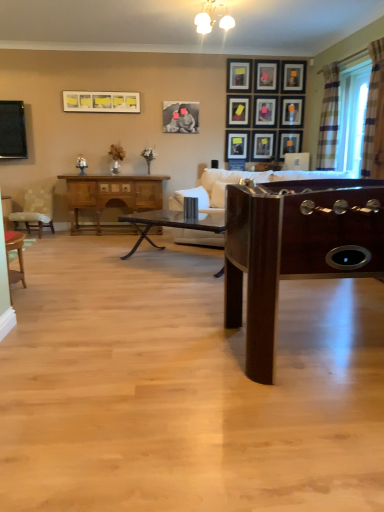
The height and width of the screenshot is (512, 384). Describe the element at coordinates (266, 75) in the screenshot. I see `matte black picture frame at upper center, placed as the fifth picture frame when sorted from right to left` at that location.

This screenshot has height=512, width=384. In order to click on plaid fabric curtain at right, which ranks as the first curtain in back-to-front order in this screenshot , I will do `click(328, 118)`.

You are a GUI agent. You are given a task and a screenshot of the screen. Output one action in this format:
    pyautogui.click(x=<x>, y=<y>)
    Task: Click on the matte black picture frame at upper center, which appears as the second picture frame when viewed from the right
    This screenshot has height=512, width=384.
    Given the screenshot: What is the action you would take?
    pyautogui.click(x=289, y=142)

You are a GUI agent. You are given a task and a screenshot of the screen. Output one action in this format:
    pyautogui.click(x=<x>, y=<y>)
    Task: Click on the plaid fabric curtain at right, the second curtain from the back
    This screenshot has width=384, height=512.
    Given the screenshot: What is the action you would take?
    pyautogui.click(x=374, y=114)

The width and height of the screenshot is (384, 512). I want to click on matte black picture frame at center, which is the sixth picture frame in right-to-left order, so click(x=263, y=145).

Where is `matte black picture frame at upper right, the 1th picture frame when ordered from right to left`? matte black picture frame at upper right, the 1th picture frame when ordered from right to left is located at coordinates (292, 111).

This screenshot has width=384, height=512. I want to click on matte black picture frame at upper center, placed as the fifth picture frame when sorted from right to left, so click(266, 75).

Which is nearer, (196, 27) or (376, 156)?

Clearly, point (196, 27) is more distant from the camera than point (376, 156).

From the image's perspective, does white glossy light fixture at upper center appear higher than plaid fabric curtain at right, the first curtain from the front?

Indeed, from the image's perspective, white glossy light fixture at upper center is shown above plaid fabric curtain at right, the first curtain from the front.

Is white glossy light fixture at upper center not within plaid fabric curtain at right, the second curtain from the back?

That's correct, white glossy light fixture at upper center is outside of plaid fabric curtain at right, the second curtain from the back.

What's the angular difference between white glossy light fixture at upper center and plaid fabric curtain at right, the second curtain from the back,'s facing directions?

4.57 degrees.

Considering the sizes of matte black television at left and matte black picture frame at upper right, the 1th picture frame when ordered from right to left, in the image, is matte black television at left bigger or smaller than matte black picture frame at upper right, the 1th picture frame when ordered from right to left,?

In the image, matte black television at left appears to be larger than matte black picture frame at upper right, the 1th picture frame when ordered from right to left.

Considering the positions of objects matte black television at left and matte black picture frame at upper right, the tenth picture frame in the left-to-right sequence, in the image provided, who is more to the left, matte black television at left or matte black picture frame at upper right, the tenth picture frame in the left-to-right sequence,?

From the viewer's perspective, matte black television at left appears more on the left side.

How far apart are matte black television at left and matte black picture frame at upper right, the tenth picture frame in the left-to-right sequence?

The distance of matte black television at left from matte black picture frame at upper right, the tenth picture frame in the left-to-right sequence, is 3.84 meters.

Considering the sizes of objects matte black television at left and matte black picture frame at upper right, the tenth picture frame in the left-to-right sequence, in the image provided, who is shorter, matte black television at left or matte black picture frame at upper right, the tenth picture frame in the left-to-right sequence,?

With less height is matte black picture frame at upper right, the tenth picture frame in the left-to-right sequence.

Looking at their sizes, would you say matte black television at left is wider or thinner than matte yellow picture frame at upper left, acting as the 1th picture frame starting from the left?

Considering their sizes, matte black television at left looks broader than matte yellow picture frame at upper left, acting as the 1th picture frame starting from the left.

Which is nearer, (0,131) or (111,109)?

Point (0,131).

Is matte black television at left facing away from matte yellow picture frame at upper left, which is counted as the tenth picture frame, starting from the right?

No, matte black television at left is not facing the opposite direction of matte yellow picture frame at upper left, which is counted as the tenth picture frame, starting from the right.

Is matte black television at left with matte yellow picture frame at upper left, which is counted as the tenth picture frame, starting from the right?

No, matte black television at left is not beside matte yellow picture frame at upper left, which is counted as the tenth picture frame, starting from the right.

Relative to matte black picture frame at upper center, which appears as the second picture frame when viewed from the right, is dark brown glass coffee table at center in front or behind?

In the image, dark brown glass coffee table at center appears in front of matte black picture frame at upper center, which appears as the second picture frame when viewed from the right.

Could you tell me if dark brown glass coffee table at center is turned towards matte black picture frame at upper center, which appears as the second picture frame when viewed from the right?

No, dark brown glass coffee table at center does not turn towards matte black picture frame at upper center, which appears as the second picture frame when viewed from the right.

Locate an element on the screen. coffee table in front of the matte black picture frame at upper center, the 9th picture frame viewed from the left is located at coordinates (171, 224).

Is dark brown glass coffee table at center positioned far away from matte black picture frame at upper center, the 9th picture frame viewed from the left?

Yes, dark brown glass coffee table at center and matte black picture frame at upper center, the 9th picture frame viewed from the left, are located far from each other.

Which of these two, matte black picture frame at center, which is the sixth picture frame in right-to-left order, or shiny dark wood foosball table at right, stands shorter?

With less height is matte black picture frame at center, which is the sixth picture frame in right-to-left order.

Can you confirm if matte black picture frame at center, which is the sixth picture frame in right-to-left order, is thinner than shiny dark wood foosball table at right?

Yes, matte black picture frame at center, which is the sixth picture frame in right-to-left order, is thinner than shiny dark wood foosball table at right.

What's the angular difference between matte black picture frame at center, the 5th picture frame positioned from the left, and shiny dark wood foosball table at right's facing directions?

The angle between the facing direction of matte black picture frame at center, the 5th picture frame positioned from the left, and the facing direction of shiny dark wood foosball table at right is 0.6 degrees.

From a real-world perspective, relative to shiny dark wood foosball table at right, is matte black picture frame at center, which is the sixth picture frame in right-to-left order, vertically above or below?

Clearly, from a real-world perspective, matte black picture frame at center, which is the sixth picture frame in right-to-left order, is above shiny dark wood foosball table at right.

From a real-world perspective, is matte black television at left positioned above or below matte black picture frame at center, which is the sixth picture frame in right-to-left order?

Clearly, from a real-world perspective, matte black television at left is above matte black picture frame at center, which is the sixth picture frame in right-to-left order.

Considering the positions of objects matte black television at left and matte black picture frame at center, which is the sixth picture frame in right-to-left order, in the image provided, who is more to the left, matte black television at left or matte black picture frame at center, which is the sixth picture frame in right-to-left order,?

Positioned to the left is matte black television at left.

Does matte black television at left have a lesser width compared to matte black picture frame at center, the 5th picture frame positioned from the left?

No.

At what (x,y) coordinates should I click in order to perform the action: click on television above the matte black picture frame at center, which is the sixth picture frame in right-to-left order (from the image's perspective). Please return your answer as a coordinate pair (x, y). The height and width of the screenshot is (512, 384). Looking at the image, I should click on (12, 130).

Between matte black television at left and matte black picture frame at upper right, the third picture frame in the right-to-left sequence, which one is positioned in front?

matte black television at left.

Who is smaller, matte black television at left or matte black picture frame at upper right, the eighth picture frame positioned from the left?

matte black picture frame at upper right, the eighth picture frame positioned from the left, is smaller.

Is matte black television at left not close to matte black picture frame at upper right, the eighth picture frame positioned from the left?

Indeed, matte black television at left is not near matte black picture frame at upper right, the eighth picture frame positioned from the left.

From the image's perspective, is matte black television at left beneath matte black picture frame at upper right, the eighth picture frame positioned from the left?

Indeed, from the image's perspective, matte black television at left is shown beneath matte black picture frame at upper right, the eighth picture frame positioned from the left.

Where is `light fixture above the plaid fabric curtain at right, the second curtain from the back (from the image's perspective)`? light fixture above the plaid fabric curtain at right, the second curtain from the back (from the image's perspective) is located at coordinates (213, 18).

There is a matte black television at left. In order to click on the 2nd picture frame above it (from a real-world perspective) in this screenshot , I will do `click(292, 111)`.

From the image, which object appears to be nearer to wooden chair at lower left, which is counted as the 2th chair, starting from the back, plaid fabric curtain at right, which is counted as the 2th curtain, starting from the front, or white glossy light fixture at upper center?

white glossy light fixture at upper center.

Consider the image. Based on their spatial positions, is matte yellow picture frame at upper left, acting as the 1th picture frame starting from the left, or matte black television at left closer to matte black picture frame at upper center, placed as the fifth picture frame when sorted from right to left?

matte yellow picture frame at upper left, acting as the 1th picture frame starting from the left, lies closer to matte black picture frame at upper center, placed as the fifth picture frame when sorted from right to left, than the other object.

Considering their positions, is patterned fabric chair at left, the 2th chair viewed from the right, positioned further to white glossy light fixture at upper center than matte black television at left?

patterned fabric chair at left, the 2th chair viewed from the right, is positioned further to the anchor white glossy light fixture at upper center.

Estimate the real-world distances between objects in this image. Which object is further from wooden chair at lower left, which appears as the first chair when ordered from the bottom, white fabric couch at center or matte black picture frame at upper center, which is the seventh picture frame in left-to-right order?

matte black picture frame at upper center, which is the seventh picture frame in left-to-right order, lies further to wooden chair at lower left, which appears as the first chair when ordered from the bottom, than the other object.

Looking at the image, which one is located closer to white glossy light fixture at upper center, matte black picture frame at upper center, which is the fourth picture frame in left-to-right order, or matte black picture frame at upper right, the tenth picture frame in the left-to-right sequence?

matte black picture frame at upper center, which is the fourth picture frame in left-to-right order, lies closer to white glossy light fixture at upper center than the other object.

Considering their positions, is wooden chair at lower left, marked as the 2th chair in a top-to-bottom arrangement, positioned closer to matte black picture frame at upper right, the eighth picture frame positioned from the left, than shiny dark wood foosball table at right?

wooden chair at lower left, marked as the 2th chair in a top-to-bottom arrangement.

Based on their spatial positions, is matte black picture frame at upper right, the tenth picture frame in the left-to-right sequence, or wooden cabinet at left further from plaid fabric curtain at right, the second curtain from the back?

Among the two, wooden cabinet at left is located further to plaid fabric curtain at right, the second curtain from the back.

Considering their positions, is dark brown glass coffee table at center positioned closer to matte black picture frame at upper center, which appears as the second picture frame when viewed from the right, than patterned fabric chair at left, the second chair positioned from the front?

Based on the image, dark brown glass coffee table at center appears to be nearer to matte black picture frame at upper center, which appears as the second picture frame when viewed from the right.

Image resolution: width=384 pixels, height=512 pixels. What are the coordinates of `window screen located between plaid fabric curtain at right, the second curtain from the back, and matte black picture frame at upper center, the 9th picture frame when ordered from right to left, in the depth direction` in the screenshot? It's located at (352, 117).

Find the location of a particular element. light fixture between matte yellow picture frame at upper left, acting as the 1th picture frame starting from the left, and white fabric couch at center from left to right is located at coordinates (213, 18).

Where is `desk positioned between plaid fabric curtain at right, the first curtain from the front, and matte black picture frame at center, the 5th picture frame positioned from the left, from near to far`? This screenshot has height=512, width=384. desk positioned between plaid fabric curtain at right, the first curtain from the front, and matte black picture frame at center, the 5th picture frame positioned from the left, from near to far is located at coordinates (111, 198).

At what (x,y) coordinates should I click in order to perform the action: click on window screen between matte black picture frame at upper center, which is the fourth picture frame in left-to-right order, and dark brown glass coffee table at center in the up-down direction. Please return your answer as a coordinate pair (x, y). Looking at the image, I should click on (352, 117).